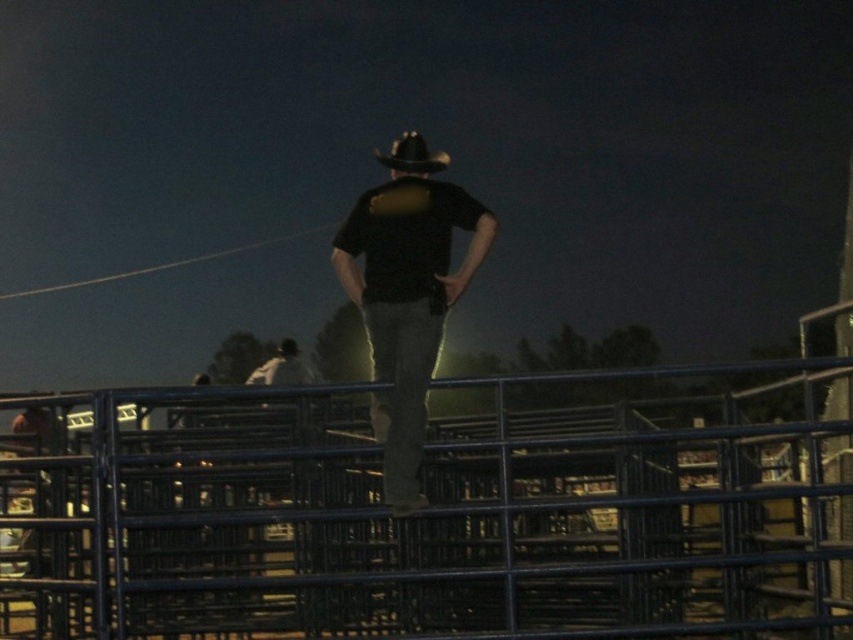
Where is `black matte shirt at center`? The image size is (853, 640). black matte shirt at center is located at coordinates (405, 292).

Where is `black matte shirt at center`? black matte shirt at center is located at coordinates (405, 292).

Identify the location of black matte shirt at center. The height and width of the screenshot is (640, 853). (405, 292).

Is point (375, 564) farther from viewer compared to point (398, 333)?

Yes.

Does blue metal fence at center have a larger size compared to black matte shirt at center?

Yes.

Is point (100, 563) behind point (399, 156)?

No.

Locate an element on the screen. The height and width of the screenshot is (640, 853). blue metal fence at center is located at coordinates (430, 516).

Which is in front, point (257, 628) or point (421, 160)?

Point (421, 160) is more forward.

Does point (0, 589) come behind point (412, 138)?

Yes, it is behind point (412, 138).

Image resolution: width=853 pixels, height=640 pixels. Find the location of `blue metal fence at center`. blue metal fence at center is located at coordinates coord(430,516).